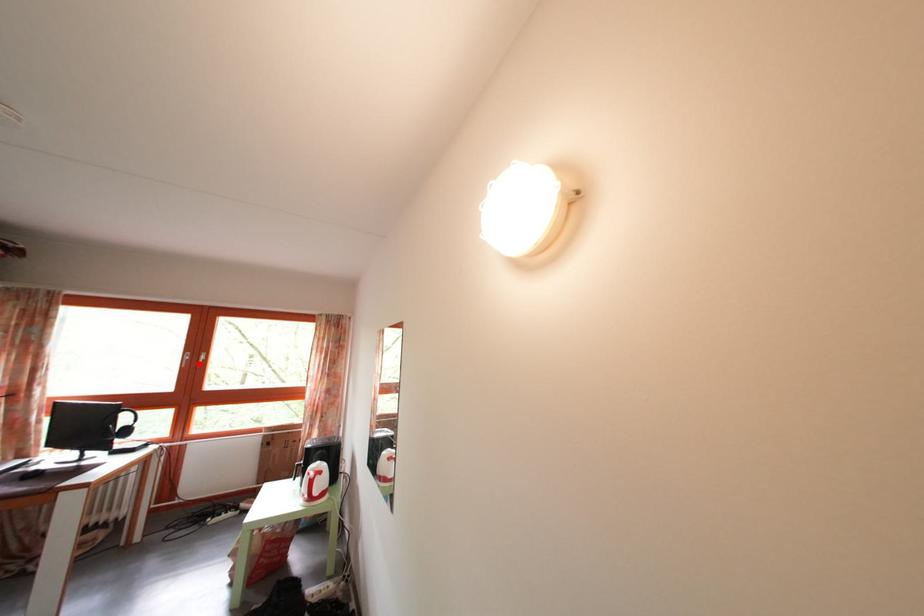
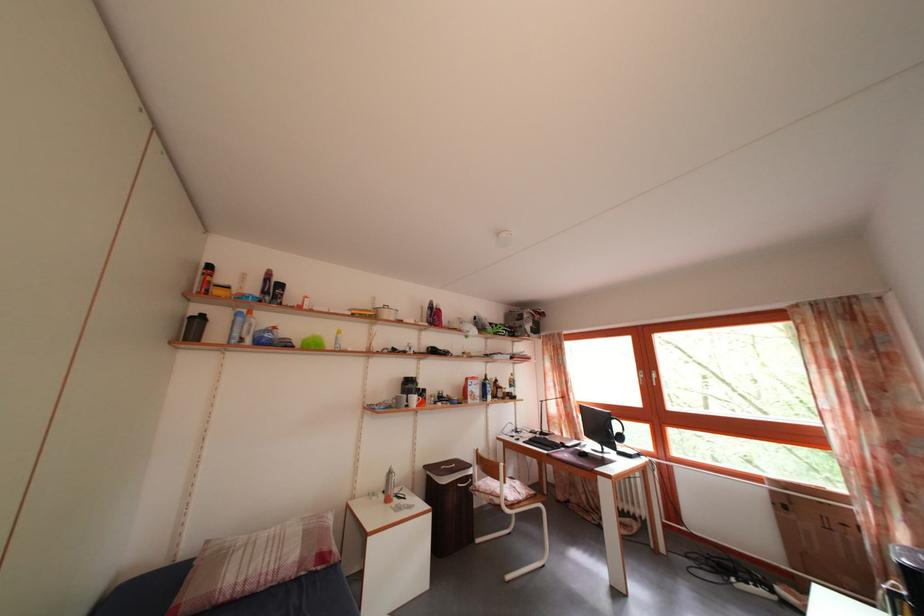
Where in the second image is the point corresponding to the highlighted location from the first image?

(652, 382)